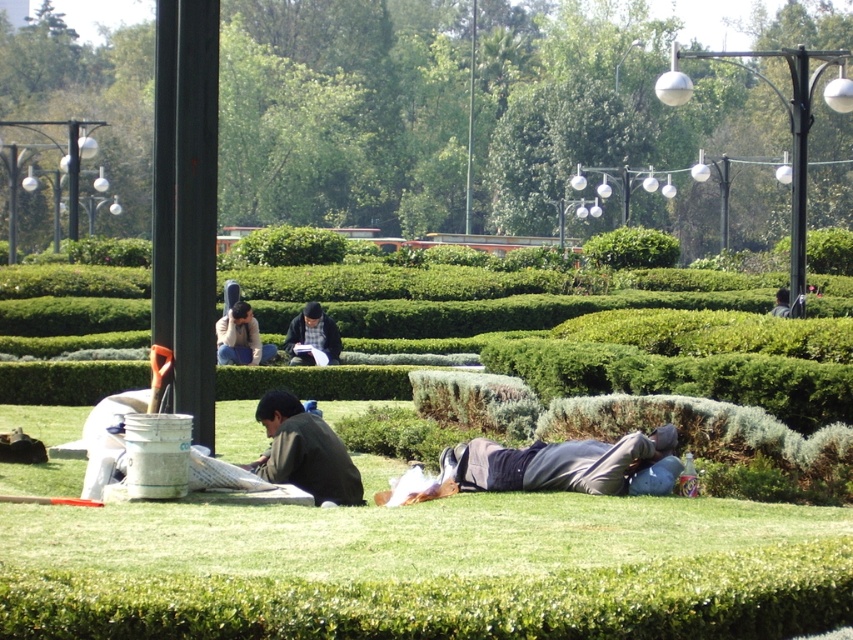
You are planning to install a new bench in the park between the matte black jacket at center and the dark gray shirt at center. The bench requires a minimum of 5 meters of space between the two objects to be placed safely. Can the bench be installed between them?

The distance between the matte black jacket at center and the dark gray shirt at center is 6.96 meters, which exceeds the required 5 meters. Therefore, the bench can be safely installed between them.

You are planning to set up a picnic blanket in the park. You have a picnic blanket that is 2 meters wide. The green grass at lower center is where you want to place it. Considering the width of the dark gray sweater at center, will the blanket fit without overlapping it?

The green grass at lower center is wider than the dark gray sweater at center. Since the blanket is 2 meters wide, it can be placed on the green grass at lower center without overlapping the dark gray sweater at center as there is sufficient width available.